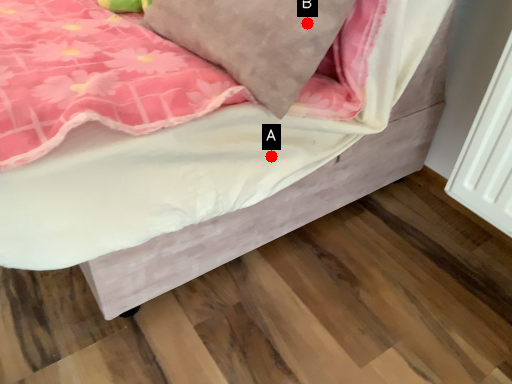
Question: Two points are circled on the image, labeled by A and B beside each circle. Among these points, which one is nearest to the camera?

Choices:
 (A) A is closer
 (B) B is closer

Answer: (B)